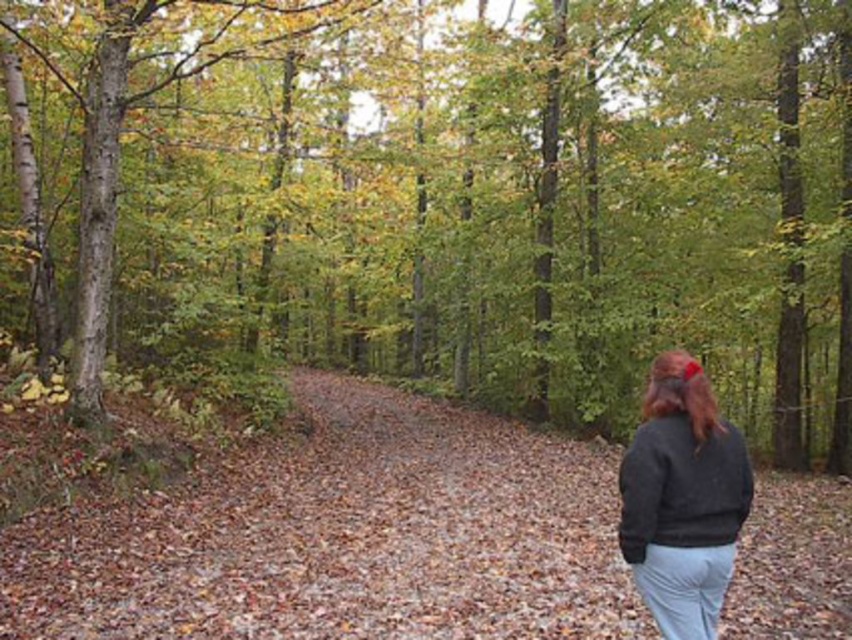
Who is more forward, (79, 540) or (695, 433)?

Point (695, 433)

The image size is (852, 640). Identify the location of brown leafy forest path at center. (343, 538).

Image resolution: width=852 pixels, height=640 pixels. Describe the element at coordinates (343, 538) in the screenshot. I see `brown leafy forest path at center` at that location.

This screenshot has width=852, height=640. I want to click on brown leafy forest path at center, so click(343, 538).

From the picture: Can you confirm if brown leafy forest path at center is positioned below brown silky hair at upper right?

Indeed, brown leafy forest path at center is positioned under brown silky hair at upper right.

Who is shorter, brown leafy forest path at center or brown silky hair at upper right?

brown leafy forest path at center is shorter.

Who is more distant from viewer, (133, 611) or (649, 417)?

Point (133, 611)

Image resolution: width=852 pixels, height=640 pixels. In order to click on brown leafy forest path at center in this screenshot , I will do `click(343, 538)`.

Is brown matte tree at center closer to camera compared to dark gray sweater at lower right?

No, it is behind dark gray sweater at lower right.

Between brown matte tree at center and dark gray sweater at lower right, which one is positioned lower?

dark gray sweater at lower right

Image resolution: width=852 pixels, height=640 pixels. I want to click on brown matte tree at center, so click(x=458, y=195).